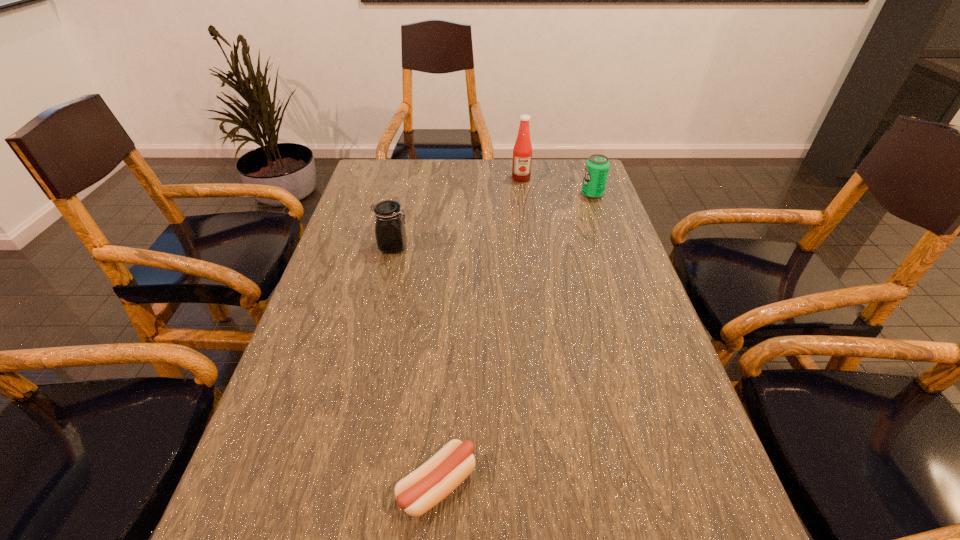
Locate an element on the screen. The height and width of the screenshot is (540, 960). vacant area at the left edge is located at coordinates [x=335, y=352].

The image size is (960, 540). I want to click on vacant space at the right edge, so click(x=669, y=369).

Where is `vacant position at the far left corner of the desktop`? vacant position at the far left corner of the desktop is located at coordinates (356, 192).

In order to click on free spot between the jar and the third object from right to left in this screenshot , I will do `click(416, 366)`.

I want to click on vacant space in between the third object from left to right and the sausage, so click(479, 332).

Locate an element on the screen. The image size is (960, 540). empty space that is in between the leftmost object and the nearest object is located at coordinates click(x=416, y=366).

Locate an element on the screen. Image resolution: width=960 pixels, height=540 pixels. vacant region between the jar and the pop soda is located at coordinates point(492,220).

In order to click on vacant space that's between the shortest object and the jar in this screenshot , I will do `click(416, 366)`.

I want to click on vacant region between the third farthest object and the nearest object, so click(x=416, y=366).

You are a GUI agent. You are given a task and a screenshot of the screen. Output one action in this format:
    pyautogui.click(x=<x>, y=<y>)
    Task: Click on the vacant space that's between the jar and the farthest object
    
    Given the screenshot: What is the action you would take?
    pyautogui.click(x=457, y=213)